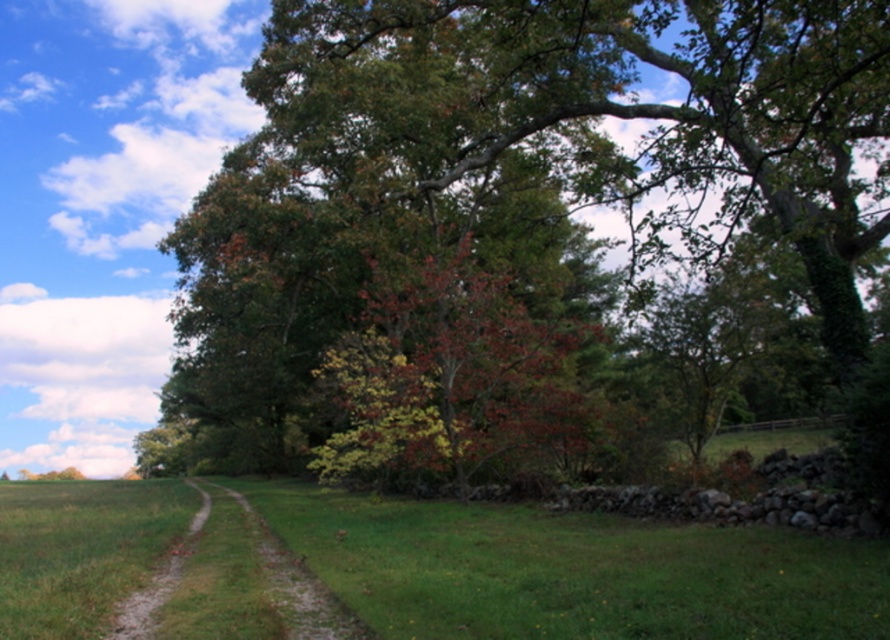
Question: Can you confirm if green leafy tree at center is thinner than green grassy trail at center?

Choices:
 (A) yes
 (B) no

Answer: (B)

Question: In this image, where is green leafy tree at center located relative to green grassy trail at center?

Choices:
 (A) above
 (B) below

Answer: (A)

Question: Which of the following is the closest to the observer?

Choices:
 (A) (812, 92)
 (B) (196, 593)

Answer: (A)

Question: Among these points, which one is nearest to the camera?

Choices:
 (A) (243, 515)
 (B) (306, 4)

Answer: (A)

Question: Which of the following is the farthest from the observer?

Choices:
 (A) green grassy trail at center
 (B) green leafy tree at center

Answer: (B)

Question: Does green leafy tree at center have a larger size compared to green grassy trail at center?

Choices:
 (A) yes
 (B) no

Answer: (A)